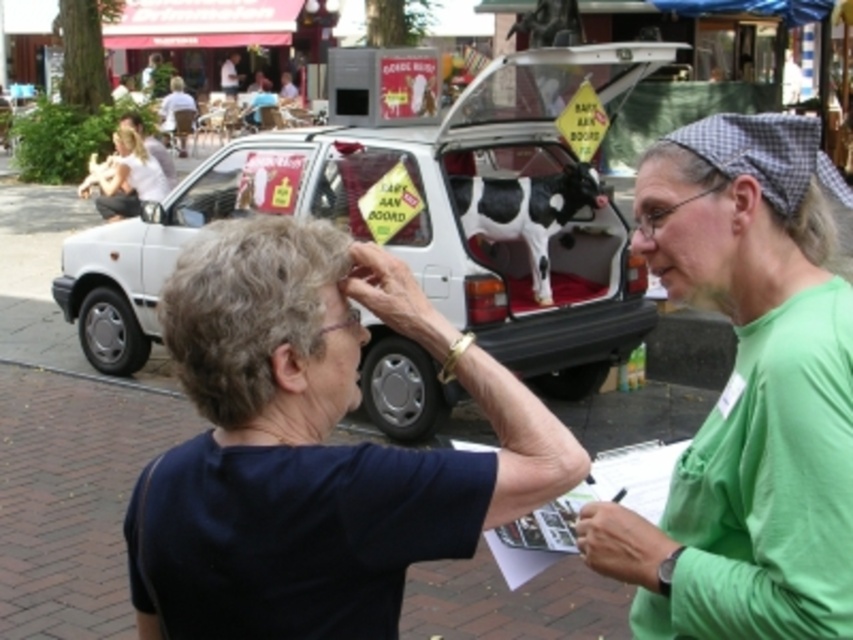
Question: Which is nearer to the white cotton shirt at upper left?

Choices:
 (A) matte green shirt at center
 (B) dark blue shirt at center

Answer: (B)

Question: Considering the real-world distances, which object is closest to the gray curly hair at upper left?

Choices:
 (A) blonde hair at upper left
 (B) white matte car at center

Answer: (B)

Question: Is gray curly hair at upper left positioned before white cotton shirt at upper left?

Choices:
 (A) no
 (B) yes

Answer: (B)

Question: Which of the following is the closest to the observer?

Choices:
 (A) smooth skin forehead at upper center
 (B) blonde hair at upper left

Answer: (A)

Question: Can you confirm if matte green shirt at center is positioned above blonde hair at upper left?

Choices:
 (A) yes
 (B) no

Answer: (B)

Question: From the image, what is the correct spatial relationship of dark blue shirt at center in relation to white matte car at center?

Choices:
 (A) above
 (B) below

Answer: (B)